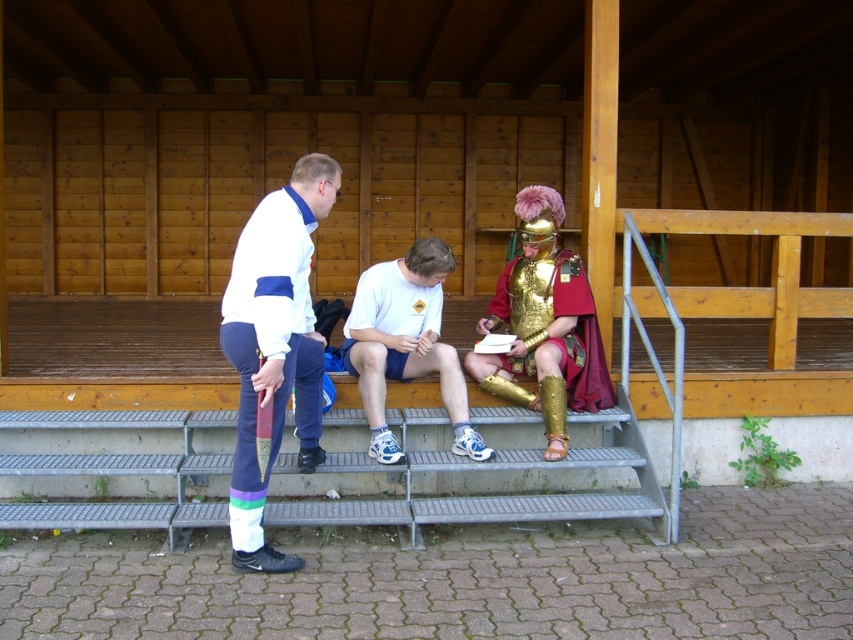
Question: Among these objects, which one is farthest from the camera?

Choices:
 (A) white fabric jacket at center
 (B) metallic gray stairs at lower center
 (C) white matte shorts at center
 (D) gold plated armor at center

Answer: (D)

Question: Is metallic gray stairs at lower center wider than white fabric jacket at center?

Choices:
 (A) no
 (B) yes

Answer: (B)

Question: Estimate the real-world distances between objects in this image. Which object is farther from the white matte shorts at center?

Choices:
 (A) white fabric jacket at center
 (B) gold plated armor at center
 (C) metallic gray stairs at lower center

Answer: (B)

Question: From the image, what is the correct spatial relationship of metallic gray stairs at lower center in relation to white fabric jacket at center?

Choices:
 (A) below
 (B) above

Answer: (A)

Question: Is white matte shorts at center thinner than gold plated armor at center?

Choices:
 (A) yes
 (B) no

Answer: (B)

Question: Among these points, which one is farthest from the camera?

Choices:
 (A) (579, 330)
 (B) (459, 435)
 (C) (637, 433)
 (D) (277, 552)

Answer: (A)